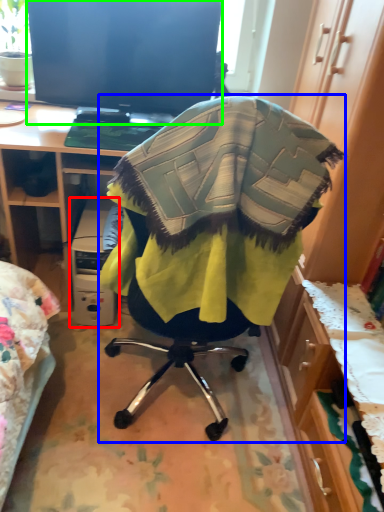
Question: Which object is positioned closest to computer (highlighted by a red box)? Select from chair (highlighted by a blue box) and television (highlighted by a green box).

Choices:
 (A) chair
 (B) television

Answer: (B)